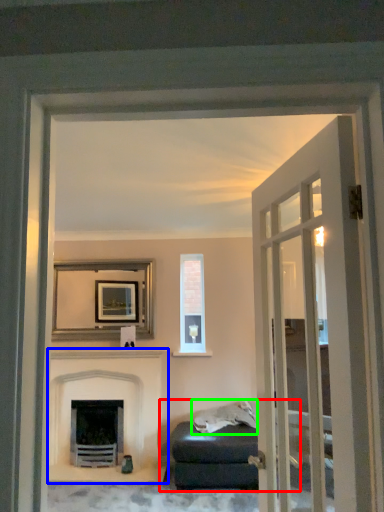
Question: Which object is positioned farthest from studio couch (highlighted by a red box)? Select from fireplace (highlighted by a blue box) and material (highlighted by a green box).

Choices:
 (A) fireplace
 (B) material

Answer: (A)